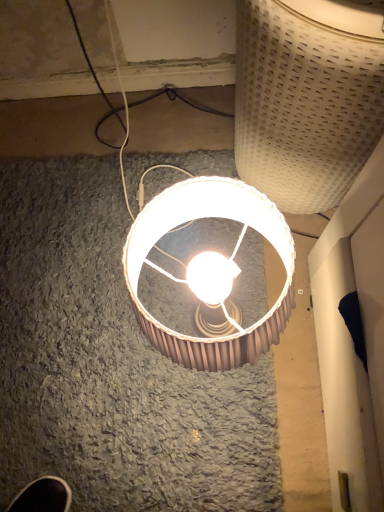
In order to click on white woven basket at upper right, positioned as the first lamp in top-to-bottom order in this screenshot , I will do `click(303, 106)`.

The height and width of the screenshot is (512, 384). Describe the element at coordinates (303, 106) in the screenshot. I see `white woven basket at upper right, positioned as the first lamp in top-to-bottom order` at that location.

Locate an element on the screen. matte brown lampshade at center, positioned as the first lamp in bottom-to-top order is located at coordinates (211, 217).

The width and height of the screenshot is (384, 512). What do you see at coordinates (211, 217) in the screenshot?
I see `matte brown lampshade at center, the 2th lamp when ordered from top to bottom` at bounding box center [211, 217].

In order to click on white woven basket at upper right, arranged as the second lamp when ordered from the bottom in this screenshot , I will do `click(303, 106)`.

Based on their positions, is white woven basket at upper right, positioned as the first lamp in top-to-bottom order, located to the left or right of matte brown lampshade at center, the 2th lamp when ordered from top to bottom?

white woven basket at upper right, positioned as the first lamp in top-to-bottom order, is positioned on matte brown lampshade at center, the 2th lamp when ordered from top to bottom,'s right side.

Is white woven basket at upper right, arranged as the second lamp when ordered from the bottom, closer to the viewer compared to matte brown lampshade at center, the 2th lamp when ordered from top to bottom?

Yes, white woven basket at upper right, arranged as the second lamp when ordered from the bottom, is in front of matte brown lampshade at center, the 2th lamp when ordered from top to bottom.

Is point (302, 53) more distant than point (206, 182)?

No, (302, 53) is closer to viewer.

From the image's perspective, does white woven basket at upper right, positioned as the first lamp in top-to-bottom order, appear lower than matte brown lampshade at center, positioned as the first lamp in bottom-to-top order?

No, from the image's perspective, white woven basket at upper right, positioned as the first lamp in top-to-bottom order, is not beneath matte brown lampshade at center, positioned as the first lamp in bottom-to-top order.

From a real-world perspective, which object stands above the other?

white woven basket at upper right, arranged as the second lamp when ordered from the bottom.

Is white woven basket at upper right, positioned as the first lamp in top-to-bottom order, wider than matte brown lampshade at center, positioned as the first lamp in bottom-to-top order?

Yes.

Does white woven basket at upper right, positioned as the first lamp in top-to-bottom order, have a greater height compared to matte brown lampshade at center, positioned as the first lamp in bottom-to-top order?

Yes, white woven basket at upper right, positioned as the first lamp in top-to-bottom order, is taller than matte brown lampshade at center, positioned as the first lamp in bottom-to-top order.

In the scene shown: Between white woven basket at upper right, arranged as the second lamp when ordered from the bottom, and matte brown lampshade at center, positioned as the first lamp in bottom-to-top order, which one has larger size?

white woven basket at upper right, arranged as the second lamp when ordered from the bottom, is bigger.

Is white woven basket at upper right, arranged as the second lamp when ordered from the bottom, not within matte brown lampshade at center, positioned as the first lamp in bottom-to-top order?

Yes, white woven basket at upper right, arranged as the second lamp when ordered from the bottom, is outside of matte brown lampshade at center, positioned as the first lamp in bottom-to-top order.

Would you say white woven basket at upper right, positioned as the first lamp in top-to-bottom order, is a long distance from matte brown lampshade at center, positioned as the first lamp in bottom-to-top order?

They are positioned close to each other.

Is white woven basket at upper right, arranged as the second lamp when ordered from the bottom, oriented towards matte brown lampshade at center, positioned as the first lamp in bottom-to-top order?

No, white woven basket at upper right, arranged as the second lamp when ordered from the bottom, is not turned towards matte brown lampshade at center, positioned as the first lamp in bottom-to-top order.

How different are the orientations of white woven basket at upper right, arranged as the second lamp when ordered from the bottom, and matte brown lampshade at center, the 2th lamp when ordered from top to bottom, in degrees?

white woven basket at upper right, arranged as the second lamp when ordered from the bottom, and matte brown lampshade at center, the 2th lamp when ordered from top to bottom, are facing 0.742 degrees away from each other.

How much distance is there between white woven basket at upper right, arranged as the second lamp when ordered from the bottom, and matte brown lampshade at center, the 2th lamp when ordered from top to bottom?

white woven basket at upper right, arranged as the second lamp when ordered from the bottom, is 9.13 inches away from matte brown lampshade at center, the 2th lamp when ordered from top to bottom.

The height and width of the screenshot is (512, 384). I want to click on lamp above the matte brown lampshade at center, positioned as the first lamp in bottom-to-top order (from the image's perspective), so click(x=303, y=106).

Based on their positions, is matte brown lampshade at center, the 2th lamp when ordered from top to bottom, located to the left or right of white woven basket at upper right, positioned as the first lamp in top-to-bottom order?

Based on their positions, matte brown lampshade at center, the 2th lamp when ordered from top to bottom, is located to the left of white woven basket at upper right, positioned as the first lamp in top-to-bottom order.

Which object is closer to the camera taking this photo, matte brown lampshade at center, the 2th lamp when ordered from top to bottom, or white woven basket at upper right, positioned as the first lamp in top-to-bottom order?

Positioned in front is white woven basket at upper right, positioned as the first lamp in top-to-bottom order.

Does point (252, 198) appear closer or farther from the camera than point (254, 104)?

Point (252, 198) is closer to the camera than point (254, 104).

Consider the image. From the image's perspective, between matte brown lampshade at center, positioned as the first lamp in bottom-to-top order, and white woven basket at upper right, positioned as the first lamp in top-to-bottom order, which one is located above?

white woven basket at upper right, positioned as the first lamp in top-to-bottom order, from the image's perspective.

From a real-world perspective, which is physically below, matte brown lampshade at center, the 2th lamp when ordered from top to bottom, or white woven basket at upper right, arranged as the second lamp when ordered from the bottom?

From a 3D spatial view, matte brown lampshade at center, the 2th lamp when ordered from top to bottom, is below.

Between matte brown lampshade at center, the 2th lamp when ordered from top to bottom, and white woven basket at upper right, arranged as the second lamp when ordered from the bottom, which one has larger width?

white woven basket at upper right, arranged as the second lamp when ordered from the bottom.

Between matte brown lampshade at center, the 2th lamp when ordered from top to bottom, and white woven basket at upper right, arranged as the second lamp when ordered from the bottom, which one has less height?

matte brown lampshade at center, the 2th lamp when ordered from top to bottom.

In terms of size, does matte brown lampshade at center, positioned as the first lamp in bottom-to-top order, appear bigger or smaller than white woven basket at upper right, positioned as the first lamp in top-to-bottom order?

matte brown lampshade at center, positioned as the first lamp in bottom-to-top order, is smaller than white woven basket at upper right, positioned as the first lamp in top-to-bottom order.

Would you say matte brown lampshade at center, the 2th lamp when ordered from top to bottom, is outside white woven basket at upper right, positioned as the first lamp in top-to-bottom order?

That's correct, matte brown lampshade at center, the 2th lamp when ordered from top to bottom, is outside of white woven basket at upper right, positioned as the first lamp in top-to-bottom order.

Is matte brown lampshade at center, positioned as the first lamp in bottom-to-top order, next to white woven basket at upper right, arranged as the second lamp when ordered from the bottom, and touching it?

No, matte brown lampshade at center, positioned as the first lamp in bottom-to-top order, is not next to white woven basket at upper right, arranged as the second lamp when ordered from the bottom.

Is matte brown lampshade at center, the 2th lamp when ordered from top to bottom, turned away from white woven basket at upper right, positioned as the first lamp in top-to-bottom order?

No, matte brown lampshade at center, the 2th lamp when ordered from top to bottom, is not facing away from white woven basket at upper right, positioned as the first lamp in top-to-bottom order.

Can you tell me how much matte brown lampshade at center, positioned as the first lamp in bottom-to-top order, and white woven basket at upper right, arranged as the second lamp when ordered from the bottom, differ in facing direction?

0.742 degrees separate the facing orientations of matte brown lampshade at center, positioned as the first lamp in bottom-to-top order, and white woven basket at upper right, arranged as the second lamp when ordered from the bottom.

How distant is matte brown lampshade at center, positioned as the first lamp in bottom-to-top order, from white woven basket at upper right, arranged as the second lamp when ordered from the bottom?

matte brown lampshade at center, positioned as the first lamp in bottom-to-top order, is 23.18 centimeters from white woven basket at upper right, arranged as the second lamp when ordered from the bottom.

Where is `lamp on the left side of white woven basket at upper right, arranged as the second lamp when ordered from the bottom`? The image size is (384, 512). lamp on the left side of white woven basket at upper right, arranged as the second lamp when ordered from the bottom is located at coordinates (211, 217).

I want to click on lamp above the matte brown lampshade at center, the 2th lamp when ordered from top to bottom (from a real-world perspective), so click(303, 106).

Find the location of a particular element. This screenshot has width=384, height=512. lamp to the right of matte brown lampshade at center, positioned as the first lamp in bottom-to-top order is located at coordinates pos(303,106).